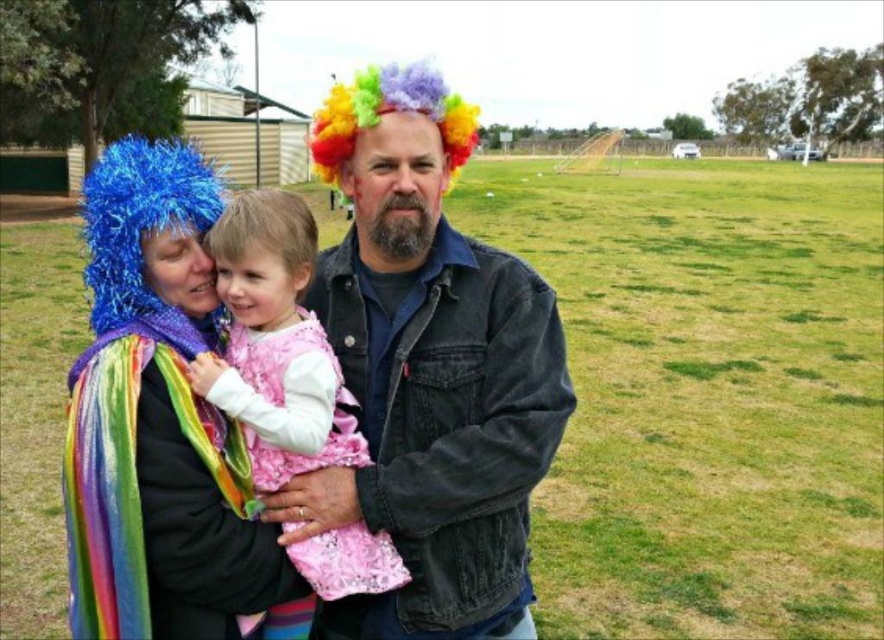
Does rainbow fabric cape at left appear under pink satin dress at center?

Incorrect, rainbow fabric cape at left is not positioned below pink satin dress at center.

Is rainbow fabric cape at left bigger than pink satin dress at center?

Indeed, rainbow fabric cape at left has a larger size compared to pink satin dress at center.

Describe the element at coordinates (158, 422) in the screenshot. I see `rainbow fabric cape at left` at that location.

In order to click on rainbow fabric cape at left in this screenshot , I will do `click(158, 422)`.

Who is higher up, denim jacket at center or pink satin dress at center?

pink satin dress at center is above.

Is the position of denim jacket at center less distant than that of pink satin dress at center?

No, denim jacket at center is further to the viewer.

Who is more forward, [427,349] or [249,365]?

Point [249,365]

Image resolution: width=884 pixels, height=640 pixels. Identify the location of denim jacket at center. (428, 371).

Between point (450, 132) and point (126, 573), which one is positioned in front?

Point (126, 573)

Who is lower down, denim jacket at center or rainbow fabric cape at left?

denim jacket at center

The width and height of the screenshot is (884, 640). I want to click on denim jacket at center, so click(428, 371).

Where is `denim jacket at center`? Image resolution: width=884 pixels, height=640 pixels. denim jacket at center is located at coordinates (428, 371).